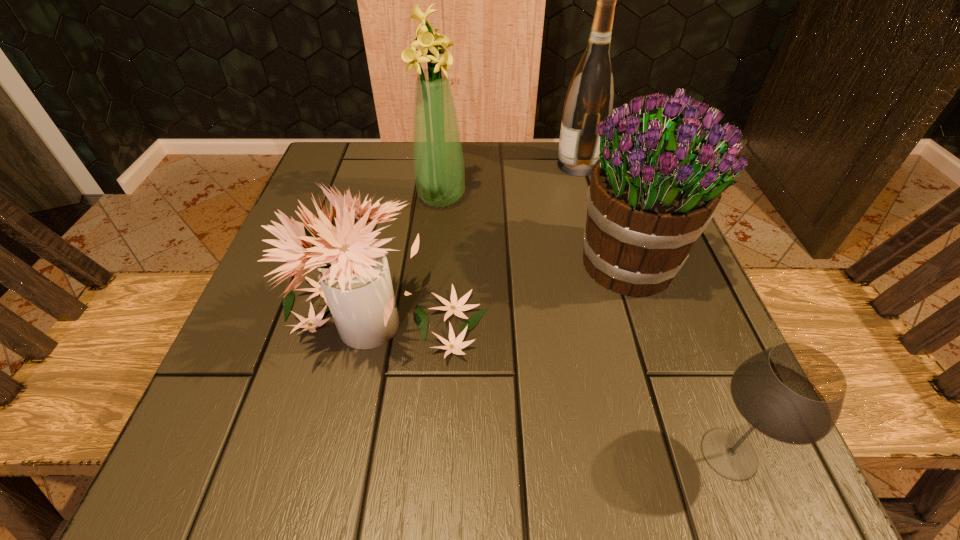
Locate an element on the screen. vacant area situated 0.190m on the label of the wine bottle is located at coordinates 473,165.

The width and height of the screenshot is (960, 540). Find the location of `vacant space located 0.370m on the label of the wine bottle`. vacant space located 0.370m on the label of the wine bottle is located at coordinates (395, 165).

Where is `vacant space located on the back of the second shortest bouquet`? vacant space located on the back of the second shortest bouquet is located at coordinates (606, 192).

Where is `blank area located 0.090m on the front of the second shortest object`? Image resolution: width=960 pixels, height=540 pixels. blank area located 0.090m on the front of the second shortest object is located at coordinates (357, 443).

This screenshot has width=960, height=540. What are the coordinates of `free location located 0.340m on the left of the shortest object` in the screenshot? It's located at (420, 454).

I want to click on bouquet that is at the far edge, so pyautogui.click(x=438, y=162).

I want to click on wine bottle that is at the far edge, so click(589, 100).

Image resolution: width=960 pixels, height=540 pixels. Identify the location of object present at the near edge. (793, 393).

Image resolution: width=960 pixels, height=540 pixels. Find the location of `object located at the left edge`. object located at the left edge is located at coordinates (356, 285).

At what (x,y) coordinates should I click in order to perform the action: click on wine bottle that is at the right edge. Please return your answer as a coordinate pair (x, y). The width and height of the screenshot is (960, 540). Looking at the image, I should click on (589, 100).